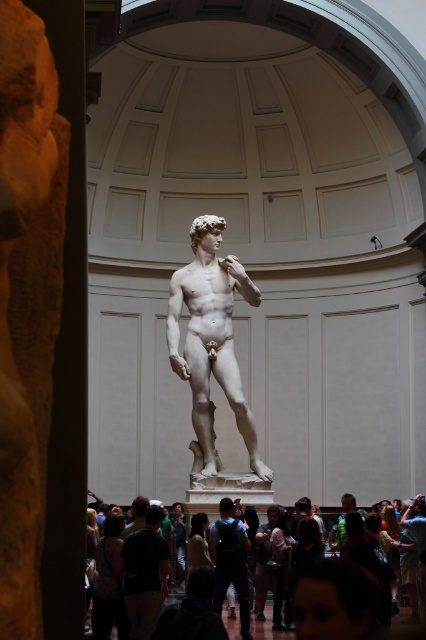
You are an art curator planning to move both the matte gray statue at center and the matte white statue at center to a new exhibition hall. The entrance of the hall has a doorway that is 2 meters wide. Can both statues pass through the doorway if they are moved one at a time?

The matte gray statue at center is bigger than the matte white statue at center. Since the doorway is 2 meters wide, we need to ensure that each statue is narrower than 2 meters. However, without specific width measurements, we cannot confirm if either statue can pass through. Additional information about their dimensions is required to determine feasibility.

You are standing in the museum and see the statue of David. There is a point marked at coordinates [267,627]. What is located at that point?

The point at coordinates [267,627] indicates the location of the matte gray crowd at center.

You are standing in the museum and want to take a photo of the statue of David. The camera you are using has a maximum focus range of 60 meters. Is the point where you are standing, located at coordinates point [236,536], within the camera focus range?

The distance of point [236,536] from the camera is 60.90 meters, which exceeds the camera maximum focus range of 60 meters. Therefore, the camera cannot focus on the statue from that point.